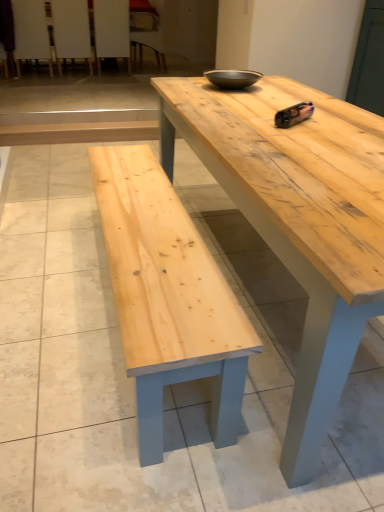
Question: Is wooden chair at upper left, which is the 1th chair from right to left, next to white wood chair at upper left, which is the 3th chair in left-to-right order?

Choices:
 (A) no
 (B) yes

Answer: (A)

Question: Is wooden chair at upper left, which is the 1th chair from right to left, to the left of white wood chair at upper left, the second chair in the right-to-left sequence, from the viewer's perspective?

Choices:
 (A) yes
 (B) no

Answer: (B)

Question: Is white wood chair at upper left, the second chair in the right-to-left sequence, located within wooden chair at upper left, which is the 1th chair from right to left?

Choices:
 (A) no
 (B) yes

Answer: (A)

Question: From the image's perspective, is wooden chair at upper left, which is the 1th chair from right to left, over white wood chair at upper left, the second chair in the right-to-left sequence?

Choices:
 (A) no
 (B) yes

Answer: (B)

Question: From the image's perspective, would you say wooden chair at upper left, the 4th chair from the left, is shown under white wood chair at upper left, the second chair in the right-to-left sequence?

Choices:
 (A) yes
 (B) no

Answer: (B)

Question: Does point (155, 39) appear closer or farther from the camera than point (379, 162)?

Choices:
 (A) farther
 (B) closer

Answer: (A)

Question: Considering the positions of wooden chair at upper left, which is the 1th chair from right to left, and natural wood table at center in the image, is wooden chair at upper left, which is the 1th chair from right to left, bigger or smaller than natural wood table at center?

Choices:
 (A) big
 (B) small

Answer: (B)

Question: From a real-world perspective, is wooden chair at upper left, the 4th chair from the left, positioned above or below natural wood table at center?

Choices:
 (A) above
 (B) below

Answer: (A)

Question: From the image's perspective, is wooden chair at upper left, which is the 1th chair from right to left, above or below natural wood table at center?

Choices:
 (A) below
 (B) above

Answer: (B)

Question: From a real-world perspective, is white wood chair at upper left, the second chair in the right-to-left sequence, positioned above or below wooden chair at upper left, positioned as the 4th chair in right-to-left order?

Choices:
 (A) above
 (B) below

Answer: (A)

Question: In the image, is white wood chair at upper left, which is the 3th chair in left-to-right order, positioned in front of or behind wooden chair at upper left, positioned as the 1th chair in left-to-right order?

Choices:
 (A) behind
 (B) front

Answer: (A)

Question: Choose the correct answer: Is white wood chair at upper left, the second chair in the right-to-left sequence, inside wooden chair at upper left, positioned as the 1th chair in left-to-right order, or outside it?

Choices:
 (A) outside
 (B) inside

Answer: (A)

Question: From the image's perspective, relative to wooden chair at upper left, positioned as the 1th chair in left-to-right order, is white wood chair at upper left, the second chair in the right-to-left sequence, above or below?

Choices:
 (A) below
 (B) above

Answer: (B)

Question: Looking at their shapes, would you say wooden chair at upper left, the 4th chair from the left, is wider or thinner than white wood chair at upper left, which is the 3th chair in left-to-right order?

Choices:
 (A) thin
 (B) wide

Answer: (B)

Question: Is wooden chair at upper left, the 4th chair from the left, to the left or to the right of white wood chair at upper left, the second chair in the right-to-left sequence, in the image?

Choices:
 (A) left
 (B) right

Answer: (B)